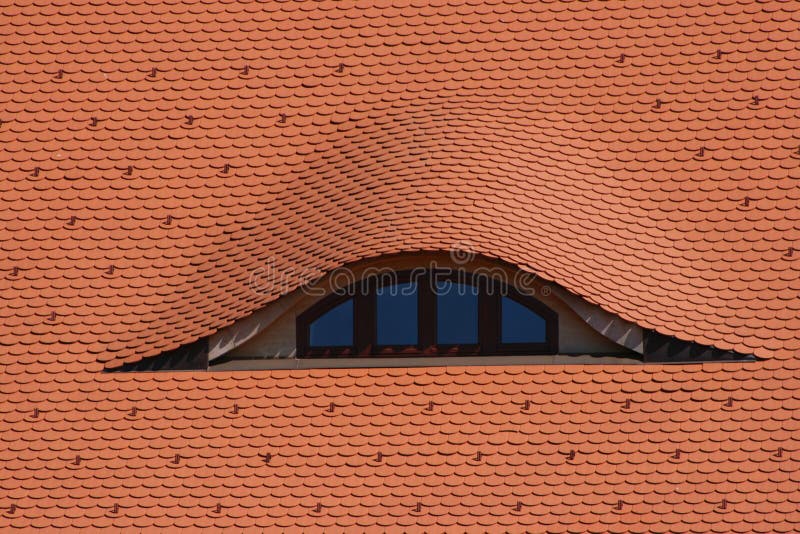
The width and height of the screenshot is (800, 534). In order to click on window pane in this screenshot , I will do `click(364, 337)`.